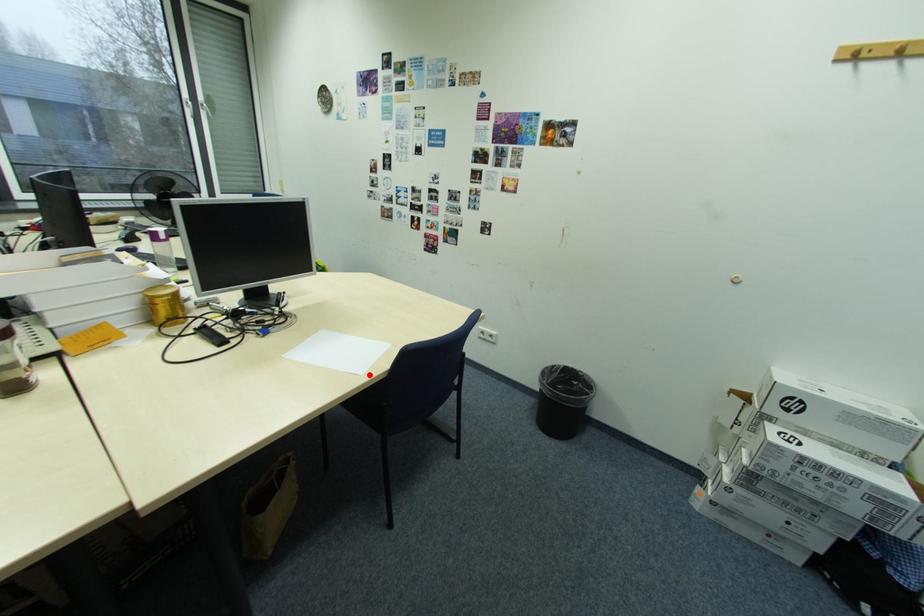
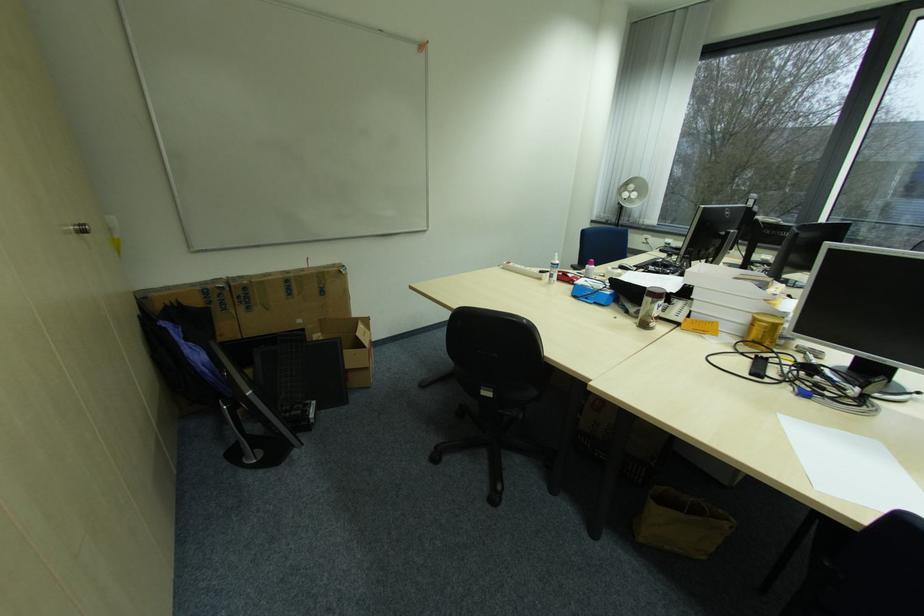
Question: I am providing you with two images of the same scene from different viewpoints. In image1, a red point is highlighted. Considering the same 3D point in image2, which of the following is correct?

Choices:
 (A) It is closer
 (B) It is farther

Answer: (B)